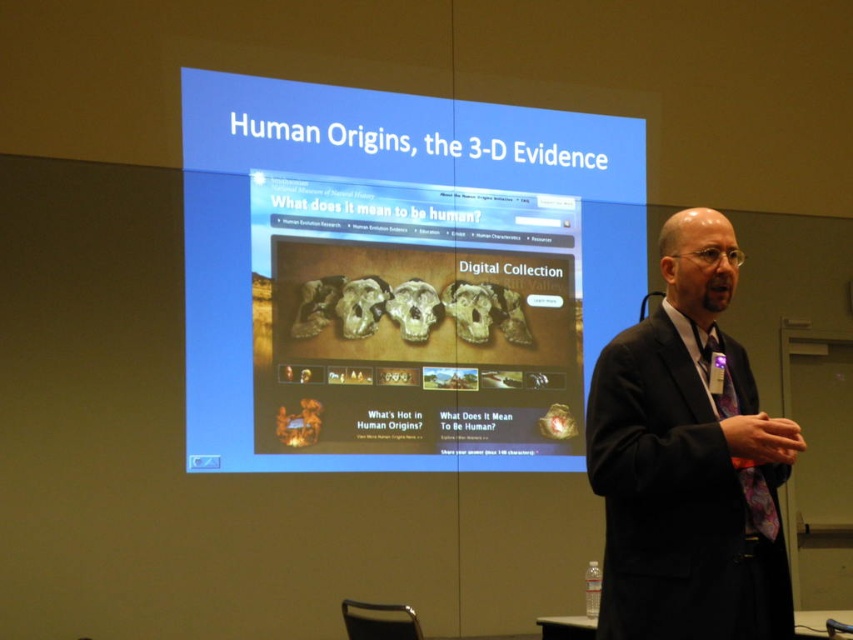
Question: Does matte digital display at center appear under black suit at center?

Choices:
 (A) yes
 (B) no

Answer: (B)

Question: Which of the following is the farthest from the observer?

Choices:
 (A) black suit at center
 (B) purple floral tie at right

Answer: (B)

Question: Does matte digital display at center appear over purple floral tie at right?

Choices:
 (A) no
 (B) yes

Answer: (B)

Question: Among these points, which one is nearest to the camera?

Choices:
 (A) (717, 364)
 (B) (213, 310)
 (C) (791, 451)

Answer: (C)

Question: Which point is closer to the camera?

Choices:
 (A) black suit at center
 (B) purple floral tie at right

Answer: (A)

Question: Does matte digital display at center lie in front of black suit at center?

Choices:
 (A) yes
 (B) no

Answer: (B)